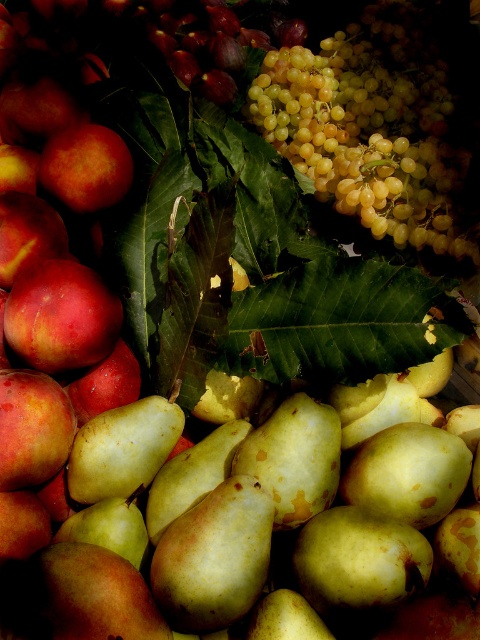
You are a customer at a fruit stand and want to grab the closest apple to you. Which apple should you choose between the matte red apple at lower left and the shiny red apple at upper left?

The matte red apple at lower left is closer to the viewer, so you should choose the matte red apple at lower left.